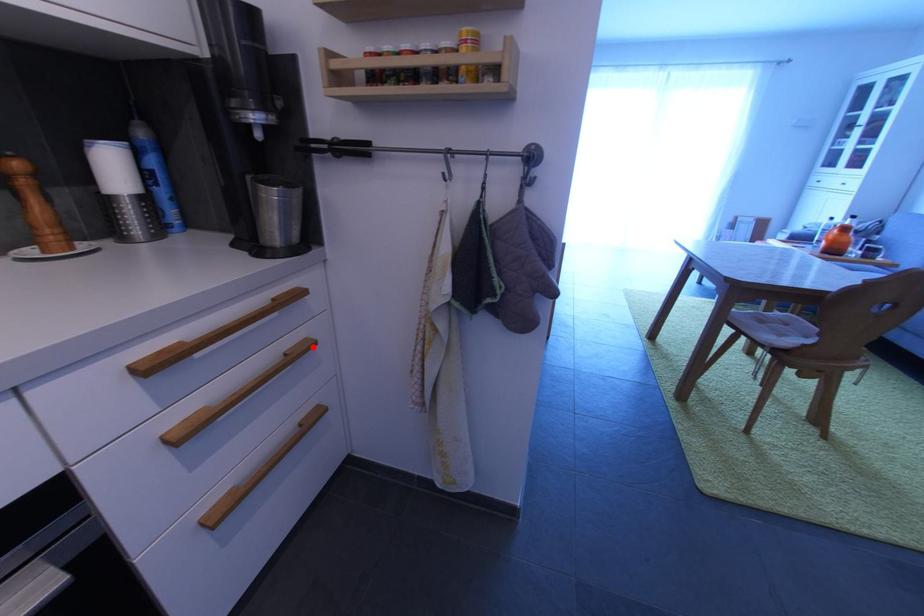
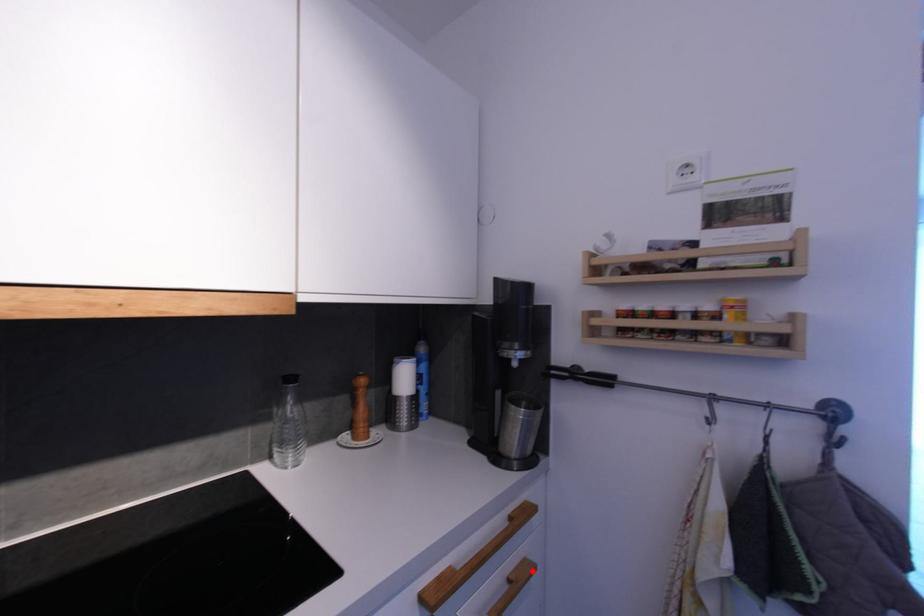
I am providing you with two images of the same scene from different viewpoints. A red point is marked on the first image and another point is marked on the second image. Do the highlighted points in image1 and image2 indicate the same real-world spot?

Yes